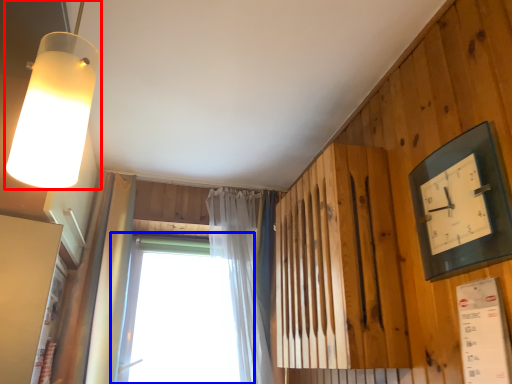
Question: Which object appears closest to the camera in this image, lamp (highlighted by a red box) or window (highlighted by a blue box)?

Choices:
 (A) lamp
 (B) window

Answer: (A)